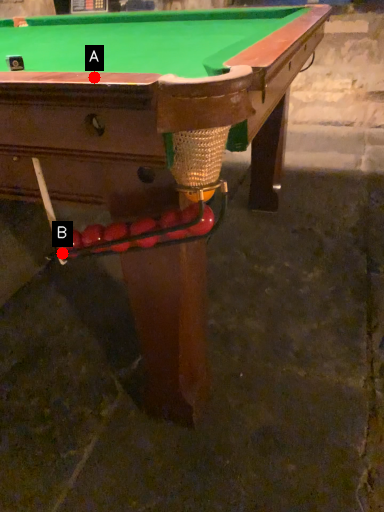
Question: Two points are circled on the image, labeled by A and B beside each circle. Which of the following is the closest to the observer?

Choices:
 (A) A is closer
 (B) B is closer

Answer: (A)